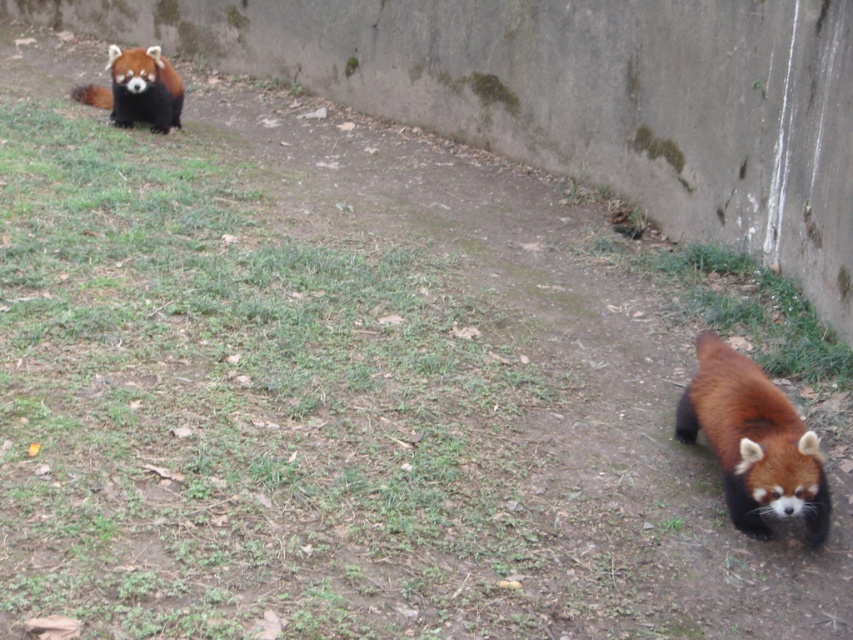
In the scene shown: You are a zookeeper observing the red pandas in their enclosure. There is a point marked at coordinates (753, 442). What does this point correspond to in the scene?

The point at coordinates (753, 442) corresponds to the fluffy reddish brown pelt at lower right.